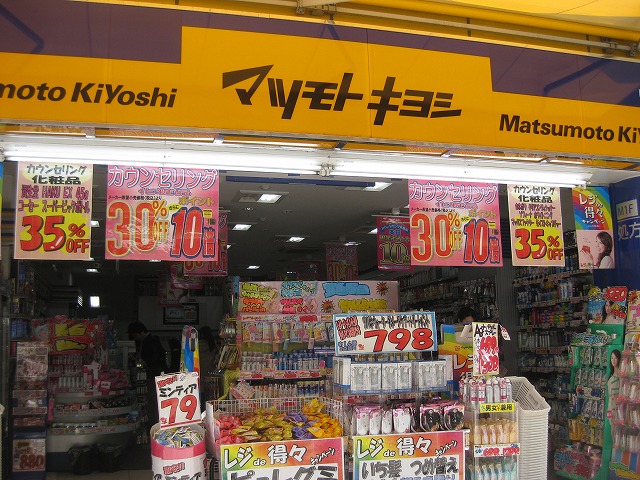
Locate an element on the screen. display basket is located at coordinates (426, 412), (301, 414), (185, 435).